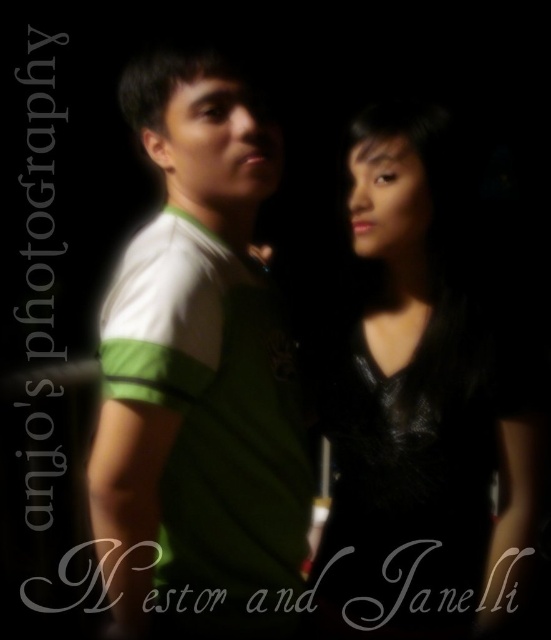
You are a photographer analyzing the composition of this image. The scene has a point at coordinates (198, 376). What object is located at this point?

The point at coordinates (198, 376) indicates the green jersey at center.

You are a photographer adjusting the lighting for a portrait. You notice the green jersey at center and the black leather dress at right. Which clothing item should you focus on first if you want to ensure proper exposure, considering their positions?

The green jersey at center should be focused on first because it is closer to the viewer than the black leather dress at right, making it the primary subject in terms of proximity.

You are a photographer reviewing this image. You notice the green jersey at center and the black leather dress at right. Which clothing item is positioned higher in the frame?

The green jersey at center is located above the black leather dress at right, so it is positioned higher in the frame.